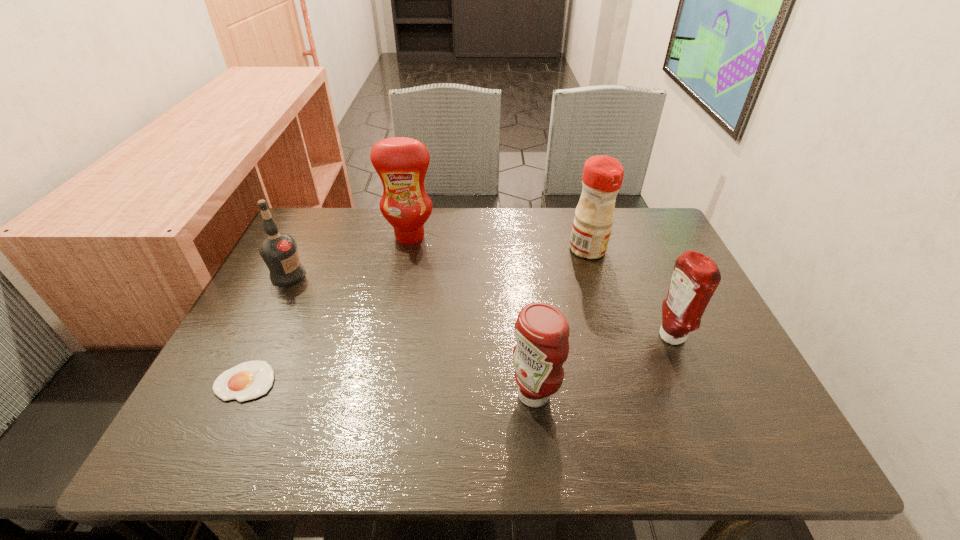
Where is `free point that satisfies the following two spatial constraints: 1. on the label side of the leftmost condiment; 2. on the left side of the third condiment from left to right`? This screenshot has height=540, width=960. free point that satisfies the following two spatial constraints: 1. on the label side of the leftmost condiment; 2. on the left side of the third condiment from left to right is located at coordinates (407, 249).

Image resolution: width=960 pixels, height=540 pixels. I want to click on vacant space that satisfies the following two spatial constraints: 1. on the label side of the leftmost condiment; 2. on the front label of the third farthest object, so click(402, 275).

Where is `vacant area in the image that satisfies the following two spatial constraints: 1. on the front side of the fifth object from left to right; 2. on the left side of the rightmost object`? vacant area in the image that satisfies the following two spatial constraints: 1. on the front side of the fifth object from left to right; 2. on the left side of the rightmost object is located at coordinates (614, 337).

Locate an element on the screen. free location that satisfies the following two spatial constraints: 1. on the front side of the fifth object from left to right; 2. on the right side of the fourth farthest object is located at coordinates (614, 337).

Find the location of `vacant space that satisfies the following two spatial constraints: 1. on the label side of the second object from right to left; 2. on the right side of the leftmost condiment`. vacant space that satisfies the following two spatial constraints: 1. on the label side of the second object from right to left; 2. on the right side of the leftmost condiment is located at coordinates (407, 249).